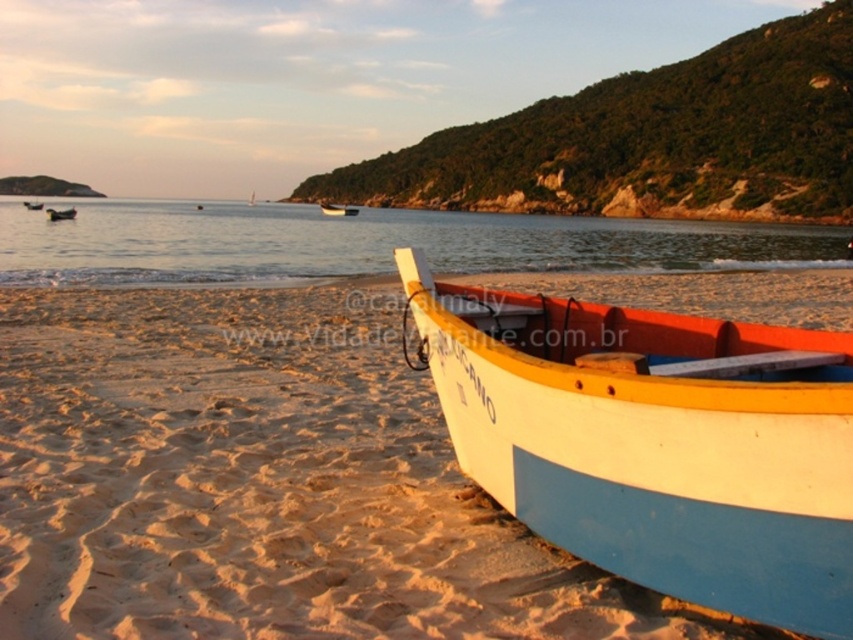
You are standing on the beach looking out at the water. You see the white painted wood boat at lower right and the wooden boat at center. Which boat is closer to the shore?

The white painted wood boat at lower right is closer to the shore because it is positioned below the wooden boat at center, which places it lower in the scene and thus nearer to the shore.

You are a photographer trying to capture both the white painted wood boat at lower right and the wooden boat at center in a single frame. Based on their sizes, which boat should you position closer to the camera to ensure both are visible clearly?

Since the white painted wood boat at lower right has a lesser width than the wooden boat at center, you should position the white painted wood boat at lower right closer to the camera to ensure both are visible clearly.

You are a photographer planning to take a photo of the wooden boat at center and the white wooden boat at lower right. Which boat should you focus on first if you want to capture the one that is closer to the camera?

The wooden boat at center is closer to the camera because it is smaller in size compared to the white wooden boat at lower right, indicating it is nearer.